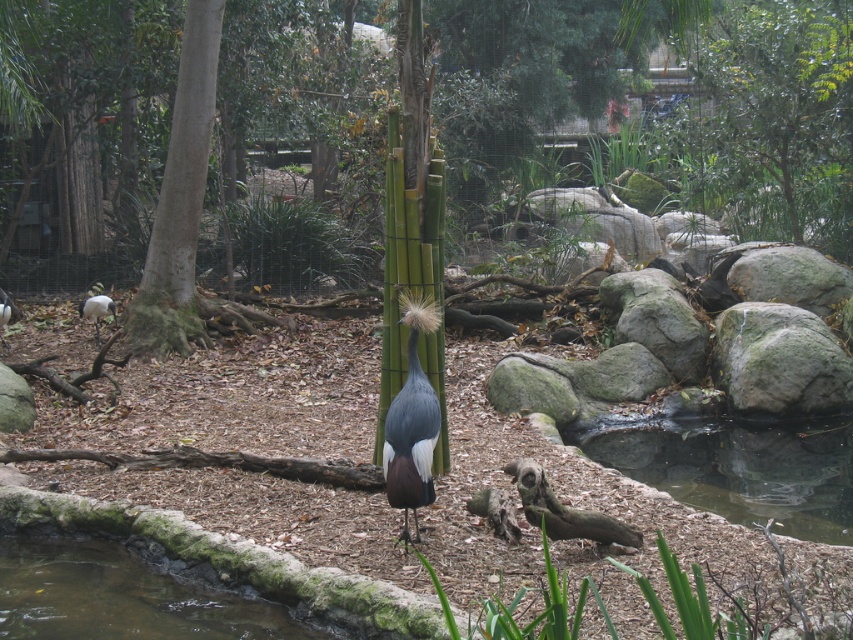
Question: Which point is farther to the camera?

Choices:
 (A) (183, 256)
 (B) (57, 616)
 (C) (412, 381)

Answer: (A)

Question: Is the position of green mossy rock at right less distant than that of white glossy bird at center?

Choices:
 (A) yes
 (B) no

Answer: (A)

Question: Which object is positioned closest to the white glossy bird at center?

Choices:
 (A) clear water at pond center
 (B) clear water at pond right
 (C) white glossy bird at left

Answer: (C)

Question: Which of the following is the closest to the observer?

Choices:
 (A) (102, 298)
 (B) (791, 337)

Answer: (B)

Question: Can you confirm if clear water at pond right is thinner than green mossy rock at right?

Choices:
 (A) yes
 (B) no

Answer: (B)

Question: Where is green mossy rock at right located in relation to gray matte bird at center in the image?

Choices:
 (A) left
 (B) right

Answer: (B)